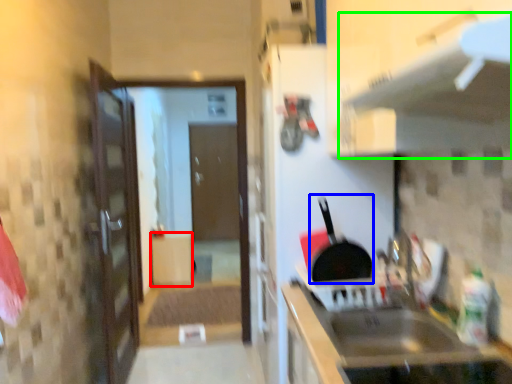
Question: Considering the real-world distances, which object is closest to cabinetry (highlighted by a red box)? frying pan (highlighted by a blue box) or exhaust hood (highlighted by a green box).

Choices:
 (A) frying pan
 (B) exhaust hood

Answer: (A)